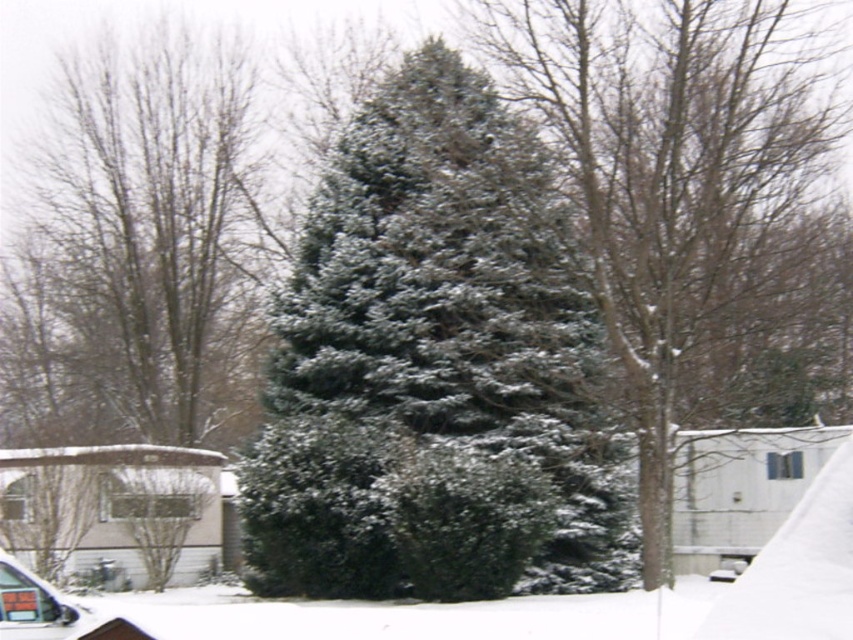
Question: Among these objects, which one is nearest to the camera?

Choices:
 (A) green matte evergreen at center
 (B) green matte fir tree at center
 (C) green matte evergreen tree at center
 (D) metallic silver car at lower left

Answer: (D)

Question: Considering the relative positions of green matte fir tree at center and green matte evergreen at center in the image provided, where is green matte fir tree at center located with respect to green matte evergreen at center?

Choices:
 (A) below
 (B) above

Answer: (A)

Question: Is green matte evergreen at center to the right of metallic silver car at lower left from the viewer's perspective?

Choices:
 (A) yes
 (B) no

Answer: (A)

Question: Among these points, which one is nearest to the camera?

Choices:
 (A) (142, 310)
 (B) (764, 147)
 (C) (57, 634)
 (D) (479, 269)

Answer: (C)

Question: Among these points, which one is farthest from the camera?

Choices:
 (A) (613, 195)
 (B) (611, 502)
 (C) (140, 260)

Answer: (C)

Question: In this image, where is green matte fir tree at center located relative to metallic silver car at lower left?

Choices:
 (A) below
 (B) above

Answer: (B)